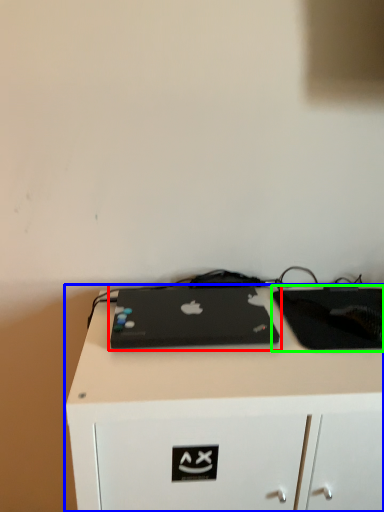
Question: Estimate the real-world distances between objects in this image. Which object is closer to laptop (highlighted by a red box), desk (highlighted by a blue box) or tablet computer (highlighted by a green box)?

Choices:
 (A) desk
 (B) tablet computer

Answer: (A)